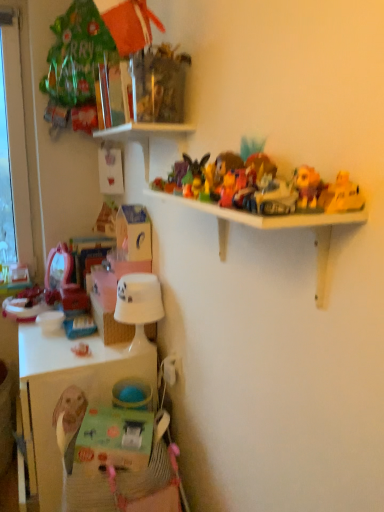
Question: Is matte cardboard box at lower left aimed at white plastic shelf at upper center?

Choices:
 (A) yes
 (B) no

Answer: (B)

Question: Can you confirm if matte cardboard box at lower left is bigger than white plastic shelf at upper center?

Choices:
 (A) no
 (B) yes

Answer: (A)

Question: Can you confirm if matte cardboard box at lower left is smaller than white plastic shelf at upper center?

Choices:
 (A) no
 (B) yes

Answer: (B)

Question: Could white plastic shelf at upper center be considered to be inside matte cardboard box at lower left?

Choices:
 (A) no
 (B) yes

Answer: (A)

Question: From the image's perspective, is matte cardboard box at lower left on top of white plastic shelf at upper center?

Choices:
 (A) no
 (B) yes

Answer: (B)

Question: Is matte cardboard box at lower left looking in the opposite direction of white plastic shelf at upper center?

Choices:
 (A) yes
 (B) no

Answer: (B)

Question: Is woven straw basket at lower center taller than white glossy lampshade at lower center?

Choices:
 (A) no
 (B) yes

Answer: (A)

Question: Does woven straw basket at lower center turn towards white glossy lampshade at lower center?

Choices:
 (A) yes
 (B) no

Answer: (B)

Question: From the image's perspective, does woven straw basket at lower center appear lower than white glossy lampshade at lower center?

Choices:
 (A) yes
 (B) no

Answer: (A)

Question: Is woven straw basket at lower center in front of white glossy lampshade at lower center?

Choices:
 (A) no
 (B) yes

Answer: (A)

Question: Can you confirm if woven straw basket at lower center is wider than white glossy lampshade at lower center?

Choices:
 (A) yes
 (B) no

Answer: (A)

Question: From a real-world perspective, does woven straw basket at lower center sit lower than white glossy lampshade at lower center?

Choices:
 (A) yes
 (B) no

Answer: (A)

Question: Does plush yellow bear at upper right, positioned as the first toy in right-to-left order, have a greater height compared to white plastic shelf at upper center?

Choices:
 (A) no
 (B) yes

Answer: (A)